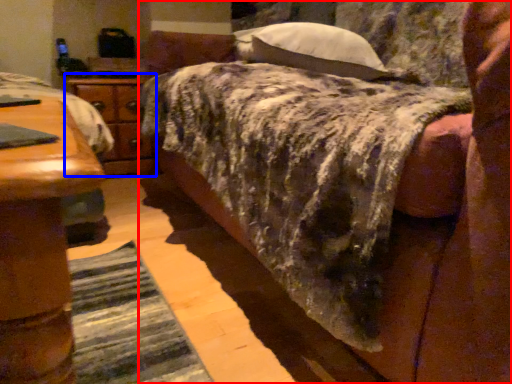
Question: Among these objects, which one is farthest to the camera, bed (highlighted by a red box) or nightstand (highlighted by a blue box)?

Choices:
 (A) bed
 (B) nightstand

Answer: (B)